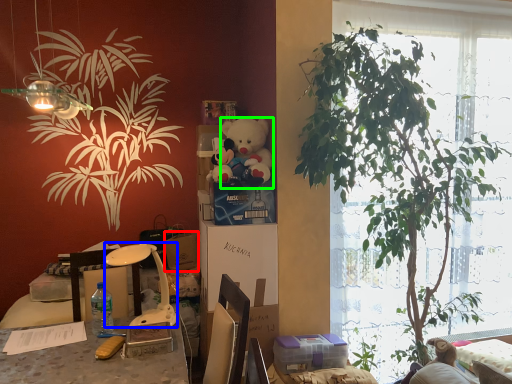
Question: Which object is the farthest from box (highlighted by a red box)? Choose among these: lamp (highlighted by a blue box) or teddy bear (highlighted by a green box).

Choices:
 (A) lamp
 (B) teddy bear

Answer: (B)